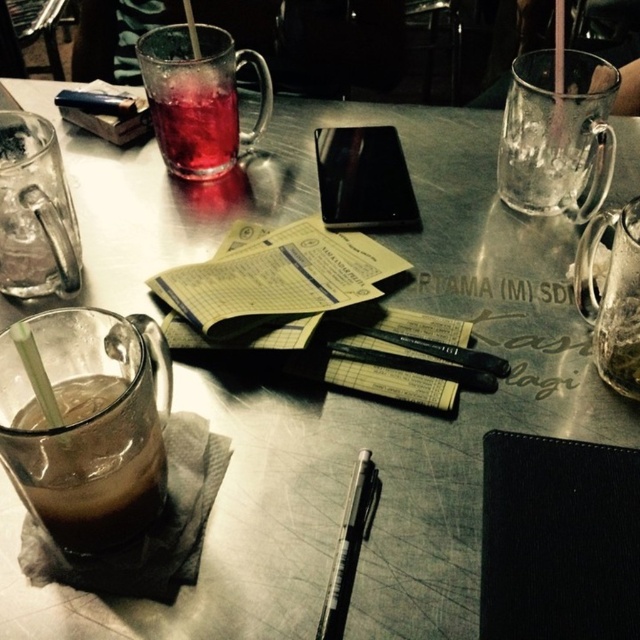
You are a barista trying to clean the table. You see the brown frothy drink at lower left and the clear plastic straw at lower left. Which item is taller?

The brown frothy drink at lower left is taller than the clear plastic straw at lower left.

You are looking at a table with a glass mug with a green straw and two pens. There is a point marked at coordinate [557,540]. What object is located at that point?

The point at coordinate [557,540] corresponds to the black leather notebook at lower right.